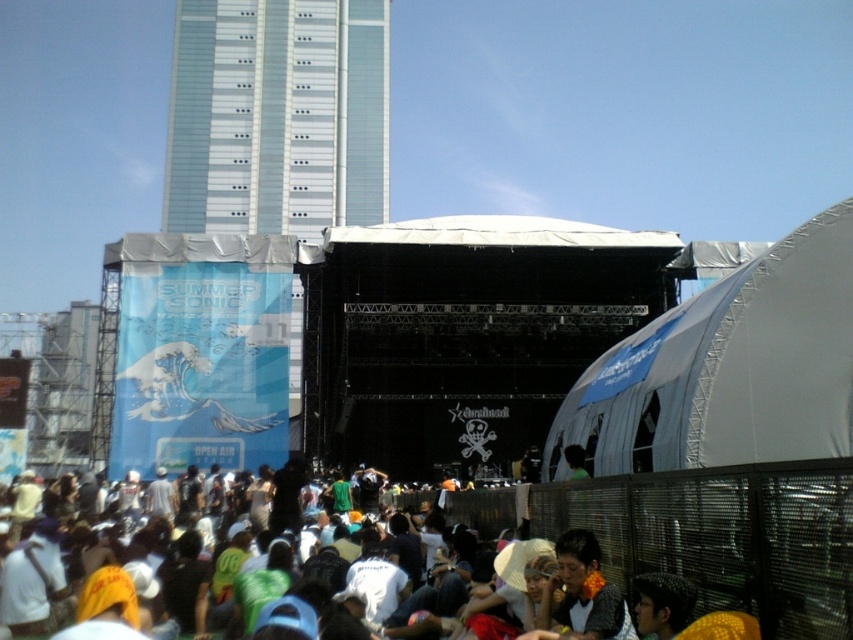
You are a photographer at the Summer Sonic concert. You want to take a photo that includes both the point at coordinates point(x=577, y=614) and point(x=173, y=152). Which point should you focus on first to ensure both are in sharp focus?

You should focus on point(x=577, y=614) first because it is closer to the viewer than point(x=173, y=152), ensuring both points are within the depth of field.

You are a photographer at the concert and want to capture both the white cotton shirt at lower center and the glassy steel tower at upper left in a single shot. Based on their positions, which object should you focus on first to ensure both are in frame?

The white cotton shirt at lower center is located below the glassy steel tower at upper left, so you should focus on the glassy steel tower at upper left first to ensure both are in frame.

You are a photographer trying to capture the white cotton shirt at lower center and the glassy steel tower at upper left in the same frame. Which object should you focus on first if you want to include both in your shot without moving the camera?

The white cotton shirt at lower center is positioned on the right side of the glassy steel tower at upper left, so you should focus on the glassy steel tower at upper left first to ensure both are in the frame.